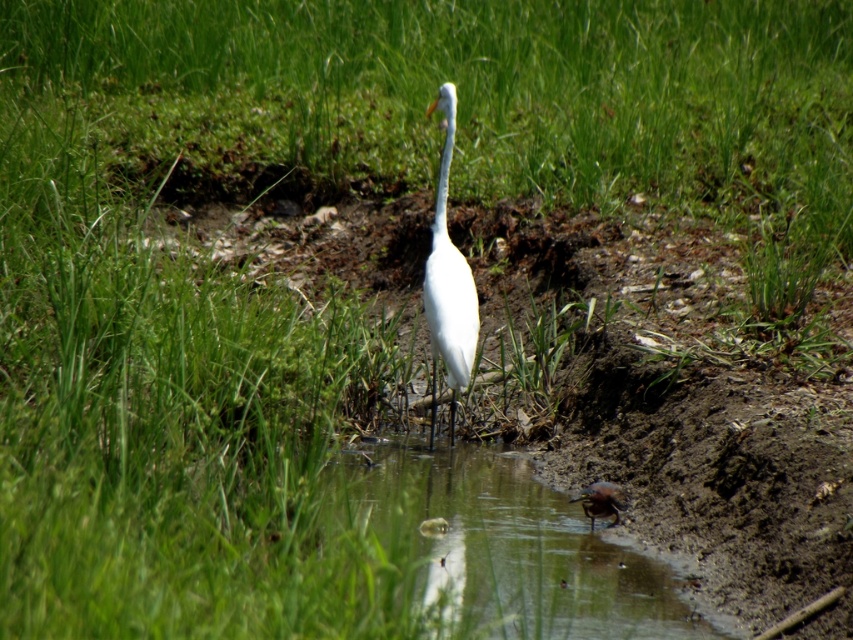
Is clear water at lower center wider than white smooth heron at center?

Indeed, clear water at lower center has a greater width compared to white smooth heron at center.

Who is shorter, clear water at lower center or white smooth heron at center?

With less height is clear water at lower center.

What do you see at coordinates (502, 547) in the screenshot?
I see `clear water at lower center` at bounding box center [502, 547].

I want to click on clear water at lower center, so [x=502, y=547].